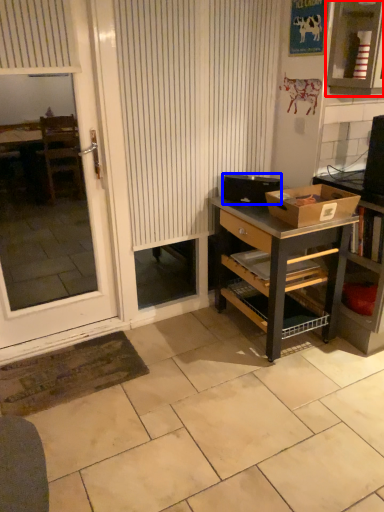
Question: Which point is further to the camera, cabinetry (highlighted by a red box) or box (highlighted by a blue box)?

Choices:
 (A) cabinetry
 (B) box

Answer: (B)